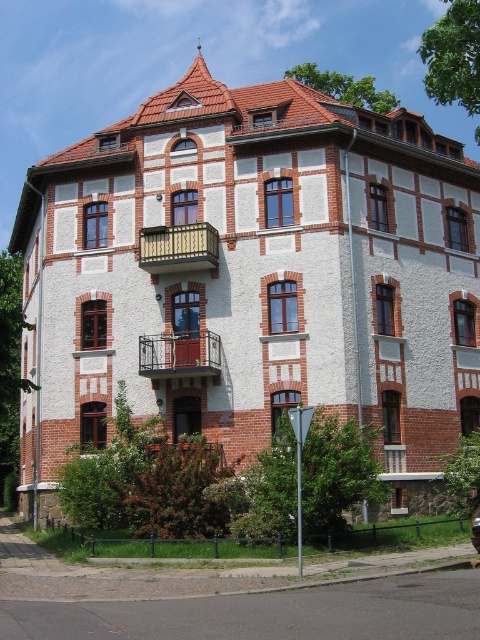
Does point (180, 264) come closer to viewer compared to point (211, 362)?

No, (180, 264) is behind (211, 362).

From the picture: Is brown wooden balcony at center positioned in front of rustic metal balcony at center?

No.

In order to click on brown wooden balcony at center in this screenshot , I will do `click(178, 248)`.